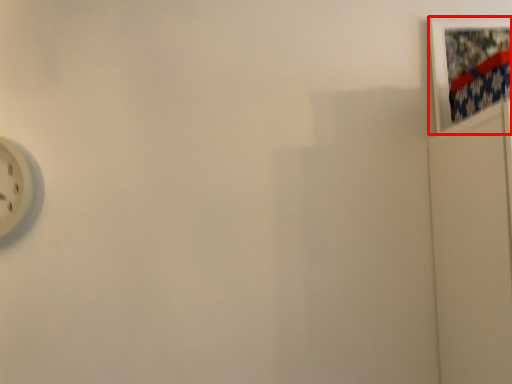
Question: In this image, where is picture frame (annotated by the red box) located relative to wall clock?

Choices:
 (A) right
 (B) left

Answer: (A)